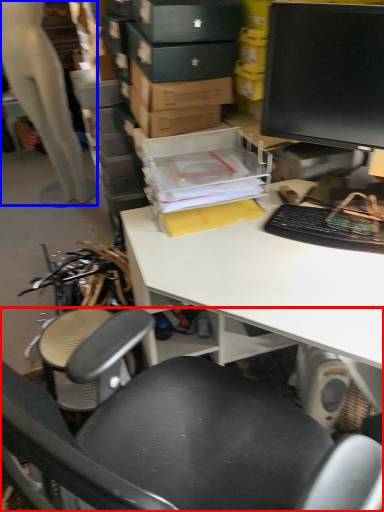
Question: Which object appears farthest to the camera in this image, chair (highlighted by a red box) or person (highlighted by a blue box)?

Choices:
 (A) chair
 (B) person

Answer: (B)